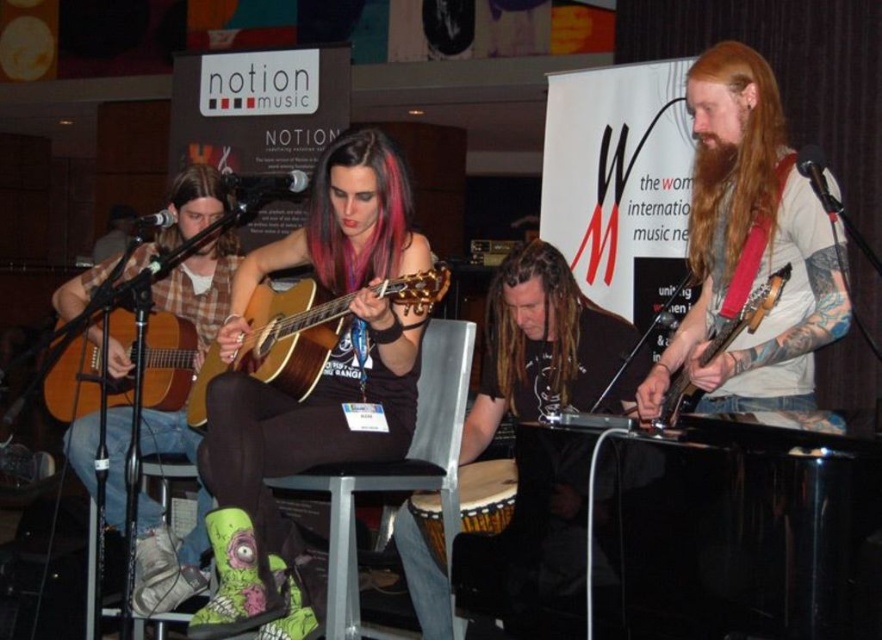
Which is in front, point (267, 384) or point (750, 310)?

Point (750, 310)

Between matte black guitar at center and matte brown electric guitar at right, which one has less height?

matte brown electric guitar at right

Between point (250, 499) and point (660, 420), which one is positioned behind?

Positioned behind is point (250, 499).

I want to click on matte black guitar at center, so click(x=314, y=385).

Who is positioned more to the left, matte black guitar at center or matte brown acoustic guitar at left?

From the viewer's perspective, matte brown acoustic guitar at left appears more on the left side.

Which is below, matte black guitar at center or matte brown acoustic guitar at left?

matte black guitar at center

Where is `matte black guitar at center`? The width and height of the screenshot is (882, 640). matte black guitar at center is located at coordinates (314, 385).

This screenshot has width=882, height=640. What are the coordinates of `matte black guitar at center` in the screenshot? It's located at (314, 385).

Can you confirm if matte brown acoustic guitar at left is positioned below matte brown electric guitar at right?

Indeed, matte brown acoustic guitar at left is positioned under matte brown electric guitar at right.

Does point (168, 406) lie behind point (662, 422)?

Yes, point (168, 406) is behind point (662, 422).

Describe the element at coordinates (81, 381) in the screenshot. The width and height of the screenshot is (882, 640). I see `matte brown acoustic guitar at left` at that location.

Locate an element on the screen. This screenshot has width=882, height=640. matte brown acoustic guitar at left is located at coordinates (81, 381).